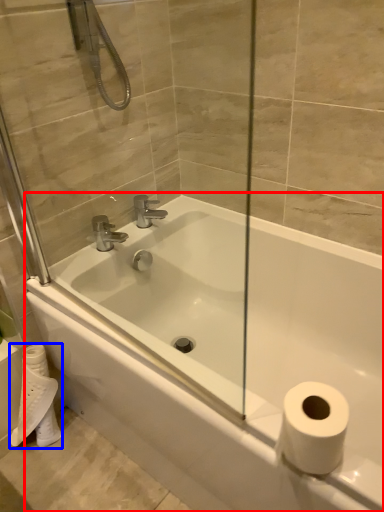
Question: Which object is closer to the camera taking this photo, bathtub (highlighted by a red box) or toilet paper (highlighted by a blue box)?

Choices:
 (A) bathtub
 (B) toilet paper

Answer: (A)